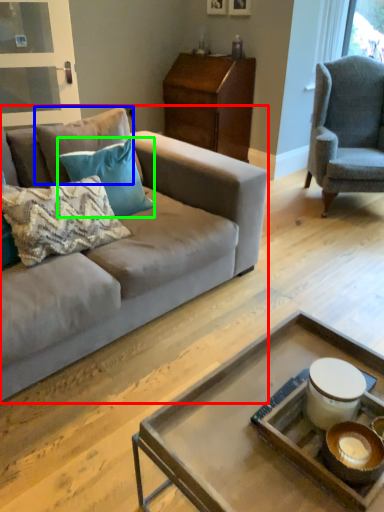
Question: Based on their relative distances, which object is nearer to studio couch (highlighted by a red box)? Choose from pillow (highlighted by a blue box) and pillow (highlighted by a green box).

Choices:
 (A) pillow
 (B) pillow

Answer: (B)